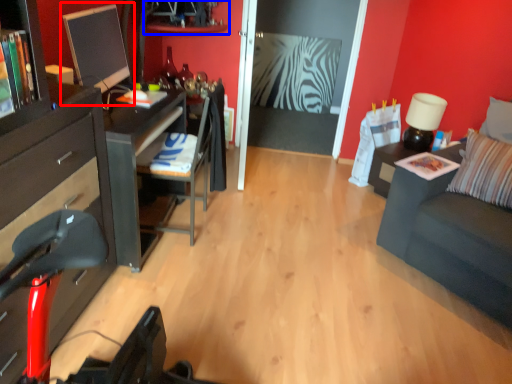
Question: Which point is closer to the camera, computer monitor (highlighted by a red box) or shelf (highlighted by a blue box)?

Choices:
 (A) computer monitor
 (B) shelf

Answer: (A)